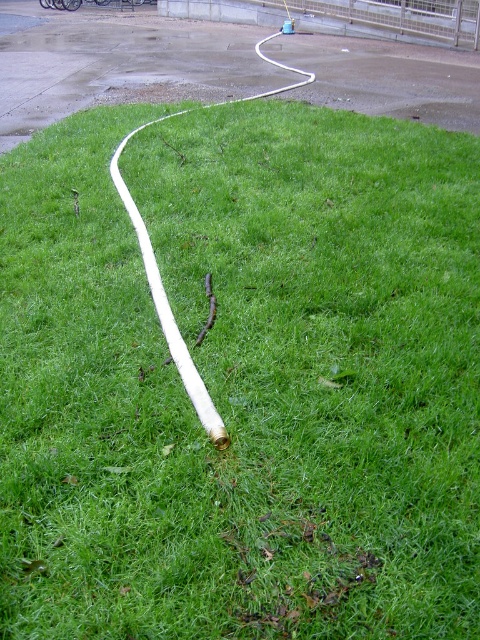
You are standing at the edge of the grassy area and see the white rubber hose at upper center and the white rubber hose at center. Which one is positioned more to the left?

The white rubber hose at upper center is positioned more to the left than the white rubber hose at center.

Based on the scene description, where is the white rubber hose at upper center located in terms of coordinates?

The white rubber hose at upper center is located at coordinates point (120, 65).

Consider the image. You are standing in the grassy area and see two points marked on the ground. The first point is at coordinate point (317,58) and the second is at coordinate point (110,163). Which point is closer to you?

Point (317,58) is further to the viewer than point (110,163), so the second point at (110,163) is closer to you.